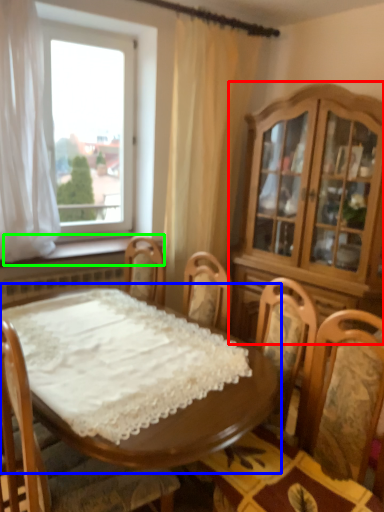
Question: Which is nearer to the cabinetry (highlighted by a red box)? table (highlighted by a blue box) or window sill (highlighted by a green box).

Choices:
 (A) table
 (B) window sill

Answer: (A)